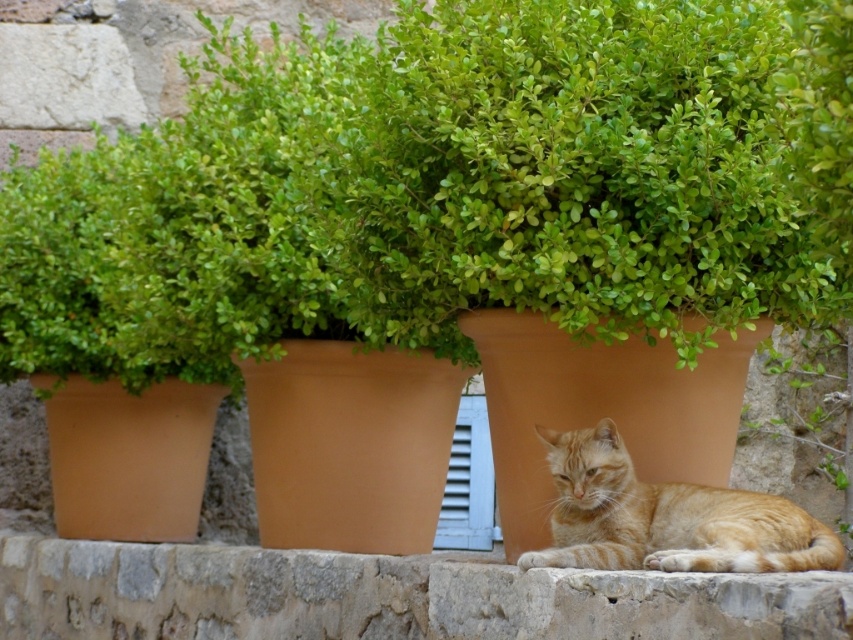
Who is more forward, (595,493) or (482,484)?

Point (595,493)

Can you confirm if orange tabby cat at lower center is positioned to the right of white plastic window at center?

Yes, orange tabby cat at lower center is to the right of white plastic window at center.

Is point (625, 552) more distant than point (463, 548)?

No.

Where is `orange tabby cat at lower center`? orange tabby cat at lower center is located at coordinates (666, 516).